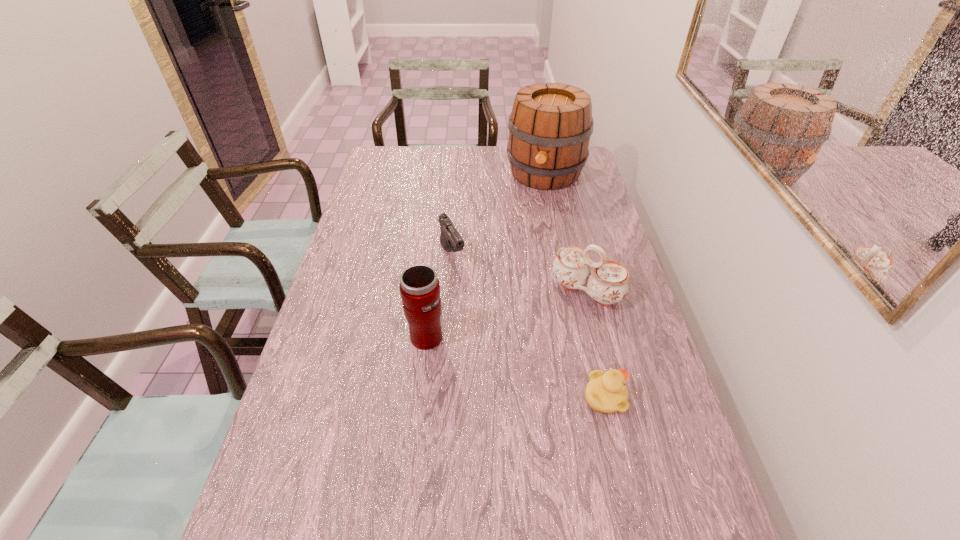
You are a GUI agent. You are given a task and a screenshot of the screen. Output one action in this format:
    pyautogui.click(x=<x>, y=<y>)
    Task: Click on the vacant space located 0.390m on the side of the farthest object where the spigot is located
    The height and width of the screenshot is (540, 960).
    Given the screenshot: What is the action you would take?
    pyautogui.click(x=517, y=264)

Find the location of a particular element. object that is positioned at the far edge is located at coordinates (550, 125).

Where is `duckling at the right edge`? The height and width of the screenshot is (540, 960). duckling at the right edge is located at coordinates (606, 392).

Find the location of `chinaware present at the right edge`. chinaware present at the right edge is located at coordinates (607, 284).

The image size is (960, 540). In order to click on cider present at the right edge in this screenshot , I will do `click(550, 125)`.

The width and height of the screenshot is (960, 540). I want to click on object at the far right corner, so click(550, 125).

Find the location of a particular element. The height and width of the screenshot is (540, 960). vacant space at the far edge of the desktop is located at coordinates (449, 176).

Where is `free space at the near edge of the desktop`? The image size is (960, 540). free space at the near edge of the desktop is located at coordinates (395, 509).

At what (x,y) coordinates should I click in order to perform the action: click on free region at the left edge of the desktop. Please return your answer as a coordinate pair (x, y). This screenshot has height=540, width=960. Looking at the image, I should click on (316, 348).

Locate an element on the screen. The width and height of the screenshot is (960, 540). vacant area at the right edge of the desktop is located at coordinates (595, 204).